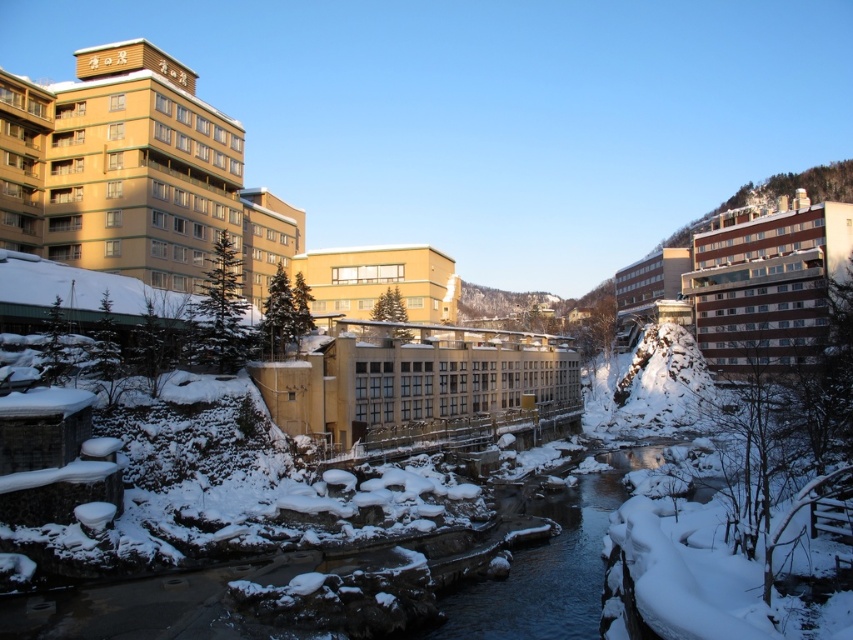
The image size is (853, 640). Describe the element at coordinates (134, 173) in the screenshot. I see `matte yellow building at upper left` at that location.

Locate an element on the screen. This screenshot has height=640, width=853. matte yellow building at upper left is located at coordinates (134, 173).

Between matte yellow building at upper left and matte yellow building at center, which one appears on the left side from the viewer's perspective?

matte yellow building at upper left is more to the left.

Locate an element on the screen. The height and width of the screenshot is (640, 853). matte yellow building at upper left is located at coordinates (134, 173).

Locate an element on the screen. The image size is (853, 640). matte yellow building at upper left is located at coordinates [134, 173].

Does beige concrete building at center have a greater height compared to white brick building at upper right?

Incorrect, beige concrete building at center's height is not larger of white brick building at upper right's.

Is beige concrete building at center wider than white brick building at upper right?

Indeed, beige concrete building at center has a greater width compared to white brick building at upper right.

Is point (450, 374) farther from camera compared to point (825, 212)?

No, (450, 374) is in front of (825, 212).

Find the location of a particular element. Image resolution: width=853 pixels, height=640 pixels. beige concrete building at center is located at coordinates (416, 381).